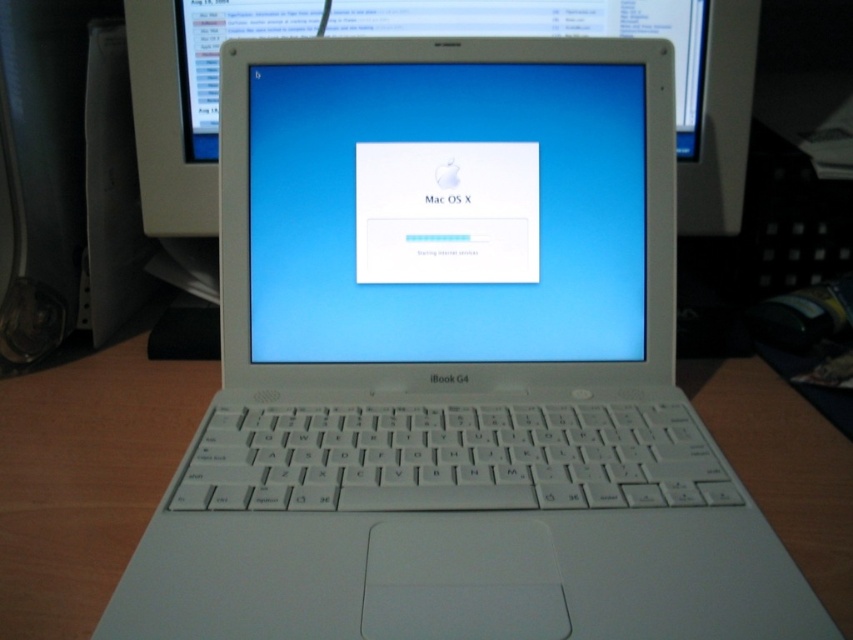
You are setting up a new workspace and want to place a ruler horizontally between the white glossy screen at center and the white plastic keyboard at center. If the ruler is 15 cm long, will it fit perfectly without overlapping either object?

The white glossy screen at center has a smaller width than the white plastic keyboard at center. Since the ruler is 15 cm long, it might not fit perfectly as the screen is narrower than the keyboard. However, without exact measurements, we can only conclude that the screen is narrower, so the ruler might extend beyond the screen or not reach the keyboard fully.

You are using the Apple iBook G4 laptop shown in the image. You want to click on the login button located at point (50, 593). However, there is an obstruction at point (483, 285). Which point is closer to you, the obstruction or the login button?

The point (50, 593) is closer to you than point (483, 285), so the obstruction at point (483, 285) is further away. Therefore, you can click the login button at point (50, 593) without moving the obstruction.